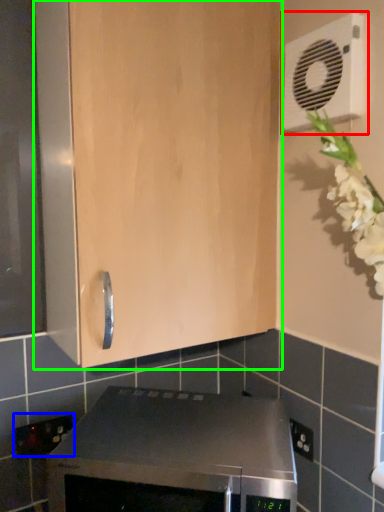
Question: Considering the real-world distances, which object is farthest from air conditioning (highlighted by a red box)? electric outlet (highlighted by a blue box) or cabinetry (highlighted by a green box)?

Choices:
 (A) electric outlet
 (B) cabinetry

Answer: (A)